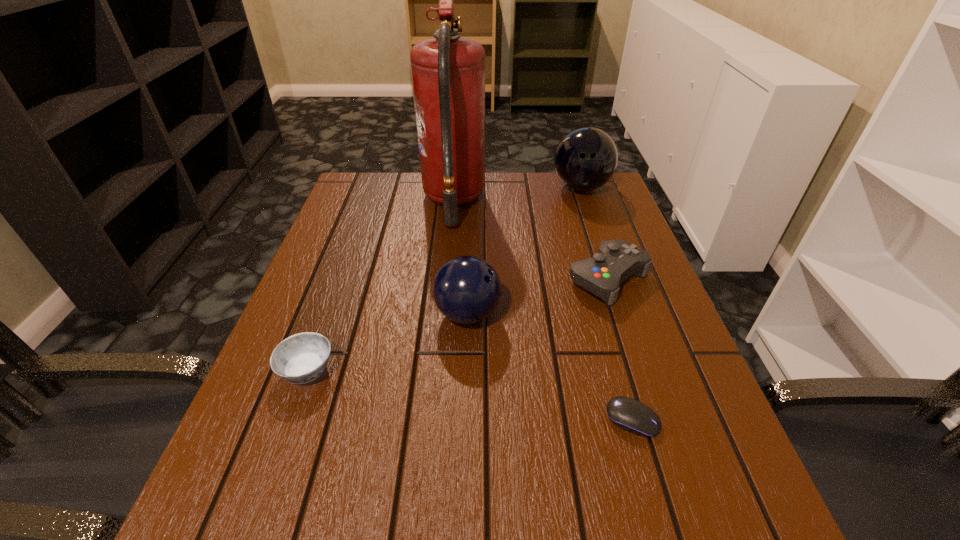
This screenshot has width=960, height=540. Find the location of `vacant space that satisfies the following two spatial constraints: 1. at the front of the fire extinguisher where the nozzle is aimed; 2. on the front side of the leftmost object`. vacant space that satisfies the following two spatial constraints: 1. at the front of the fire extinguisher where the nozzle is aimed; 2. on the front side of the leftmost object is located at coordinates (439, 370).

Locate an element on the screen. vacant space that satisfies the following two spatial constraints: 1. on the side of the farther bowling ball with the finger holes; 2. at the front of the tallest object where the nozzle is aimed is located at coordinates (586, 201).

At what (x,y) coordinates should I click in order to perform the action: click on blank space that satisfies the following two spatial constraints: 1. on the side of the farther bowling ball with the finger holes; 2. on the surface of the third tallest object near the finger holes. Please return your answer as a coordinate pair (x, y). Image resolution: width=960 pixels, height=540 pixels. Looking at the image, I should click on (624, 314).

At what (x,y) coordinates should I click in order to perform the action: click on vacant region that satisfies the following two spatial constraints: 1. on the back side of the nearest object; 2. at the front of the tallest object where the nozzle is aimed. Please return your answer as a coordinate pair (x, y). Looking at the image, I should click on (569, 201).

Where is `vacant area in the image that satisfies the following two spatial constraints: 1. on the back side of the shortest object; 2. on the left side of the control`? vacant area in the image that satisfies the following two spatial constraints: 1. on the back side of the shortest object; 2. on the left side of the control is located at coordinates (591, 279).